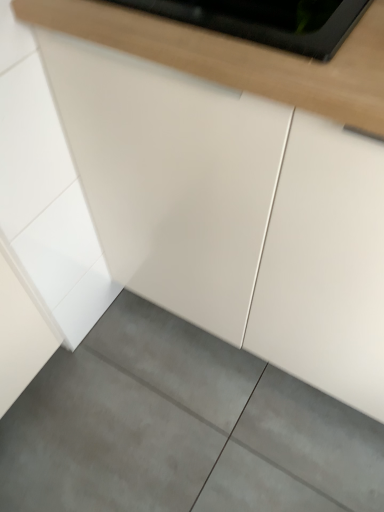
Question: Looking at their shapes, would you say gray concrete floor at lower center is wider or thinner than white glossy countertop at upper center?

Choices:
 (A) thin
 (B) wide

Answer: (B)

Question: Is gray concrete floor at lower center bigger or smaller than white glossy countertop at upper center?

Choices:
 (A) big
 (B) small

Answer: (A)

Question: From the image's perspective, is gray concrete floor at lower center positioned above or below white glossy countertop at upper center?

Choices:
 (A) above
 (B) below

Answer: (B)

Question: Considering the positions of white glossy countertop at upper center and gray concrete floor at lower center in the image, is white glossy countertop at upper center wider or thinner than gray concrete floor at lower center?

Choices:
 (A) wide
 (B) thin

Answer: (B)

Question: Is white glossy countertop at upper center bigger or smaller than gray concrete floor at lower center?

Choices:
 (A) small
 (B) big

Answer: (A)

Question: Does point (360, 113) appear closer or farther from the camera than point (321, 492)?

Choices:
 (A) farther
 (B) closer

Answer: (B)

Question: Based on their positions, is white glossy countertop at upper center located to the left or right of gray concrete floor at lower center?

Choices:
 (A) left
 (B) right

Answer: (B)